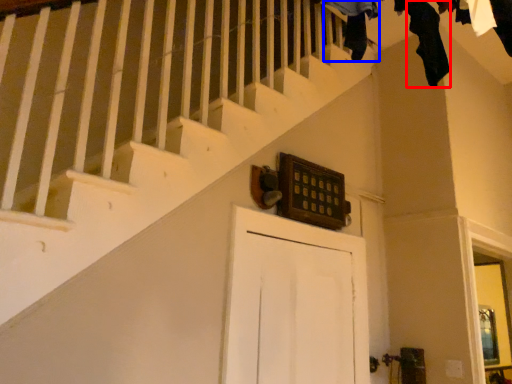
Question: Among these objects, which one is farthest to the camera, clothing (highlighted by a red box) or clothing (highlighted by a blue box)?

Choices:
 (A) clothing
 (B) clothing

Answer: (A)